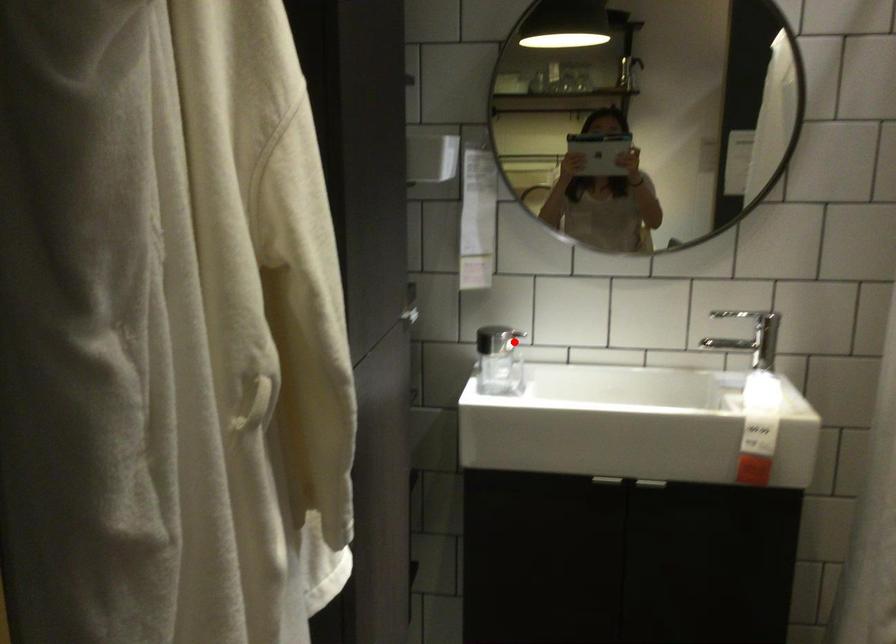
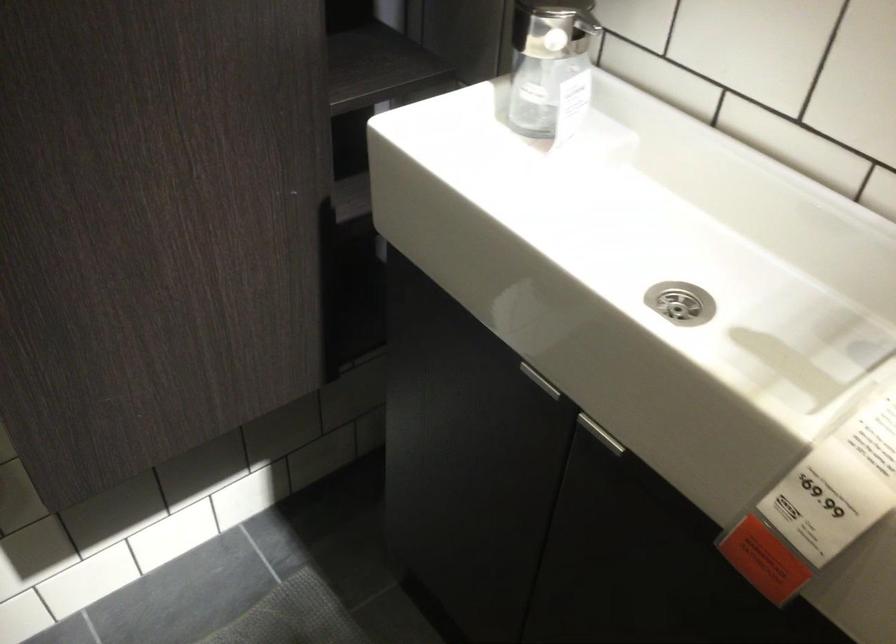
The point at the highlighted location is marked in the first image. Where is the corresponding point in the second image?

(547, 35)